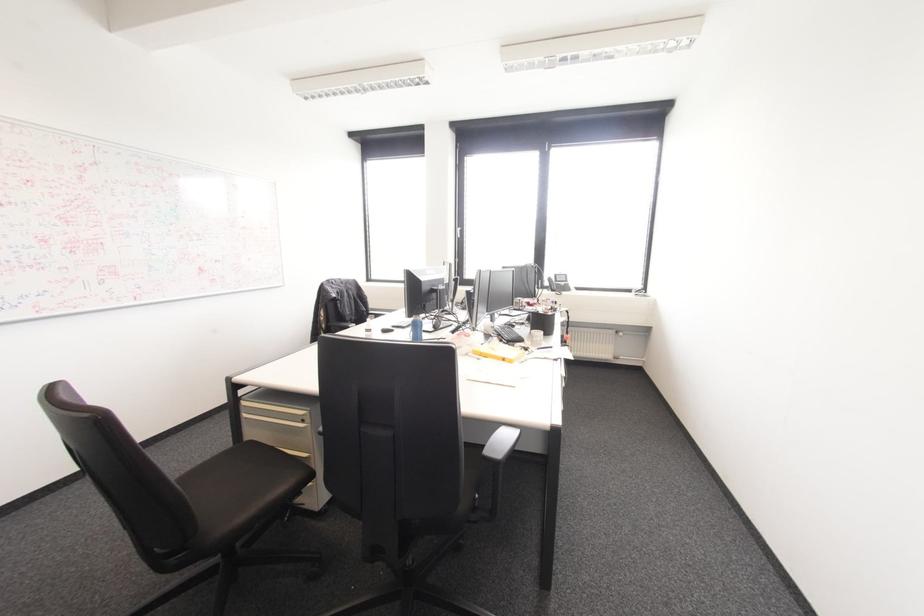
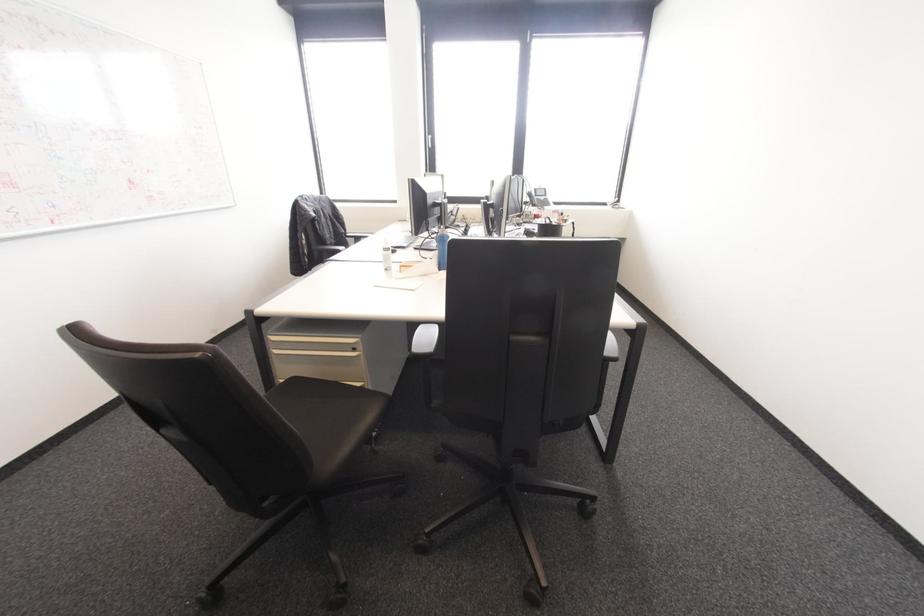
Where in the second image is the point corresponding to point 302,419 from the first image?

(354, 349)